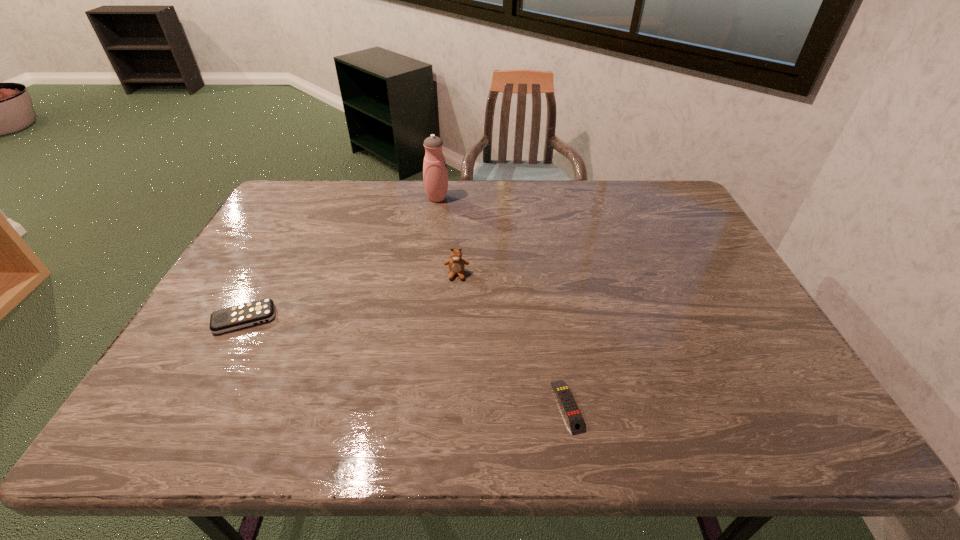
I want to click on vacant space at the far right corner of the desktop, so click(650, 194).

What are the coordinates of `unoccupied area between the leftmost object and the thermos bottle` in the screenshot? It's located at (341, 259).

This screenshot has width=960, height=540. I want to click on empty space that is in between the left remote control and the second object from right to left, so click(x=350, y=296).

Locate an element on the screen. vacant area that lies between the thermos bottle and the shorter remote control is located at coordinates (502, 302).

This screenshot has height=540, width=960. I want to click on vacant area between the third tallest object and the nearer remote control, so click(406, 362).

In order to click on empty space that is in between the nearest object and the third object from right to left in this screenshot , I will do `click(502, 302)`.

Identify the location of empty space that is in between the second shortest object and the teddy bear. The height and width of the screenshot is (540, 960). (350, 296).

Locate an element on the screen. The width and height of the screenshot is (960, 540). free spot between the farthest object and the second farthest object is located at coordinates (447, 237).

Find the location of a particular element. This screenshot has width=960, height=540. vacant area between the second tallest object and the farthest object is located at coordinates (447, 237).

Where is `empty space between the taller remote control and the rightmost object`? The height and width of the screenshot is (540, 960). empty space between the taller remote control and the rightmost object is located at coordinates (406, 362).